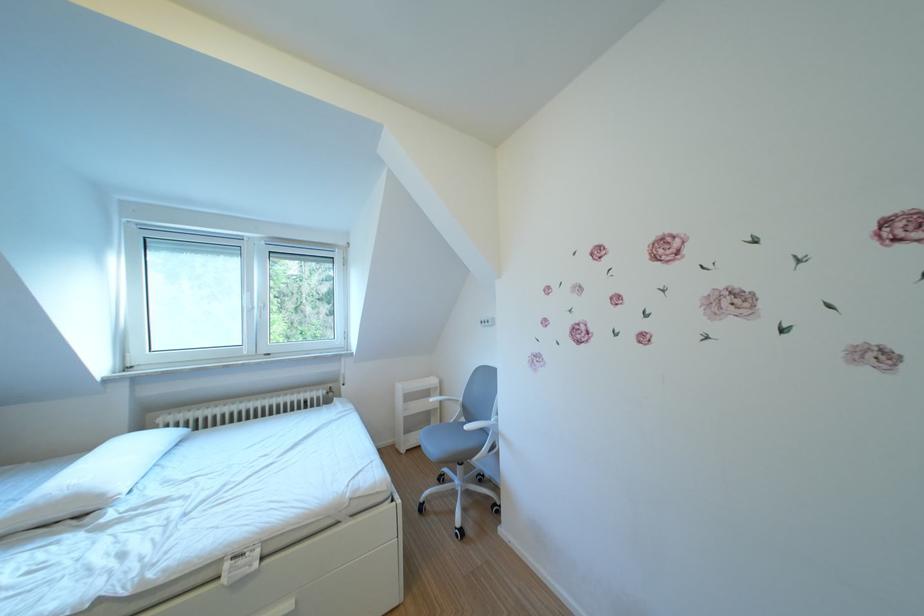
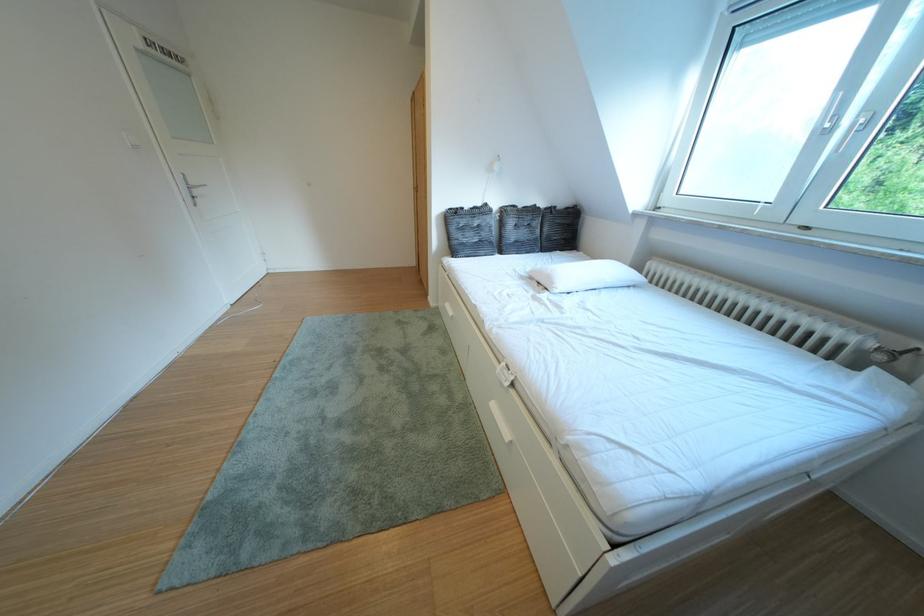
The images are taken continuously from a first-person perspective. In which direction is your viewpoint rotating?

The rotation direction of the camera is left-down.